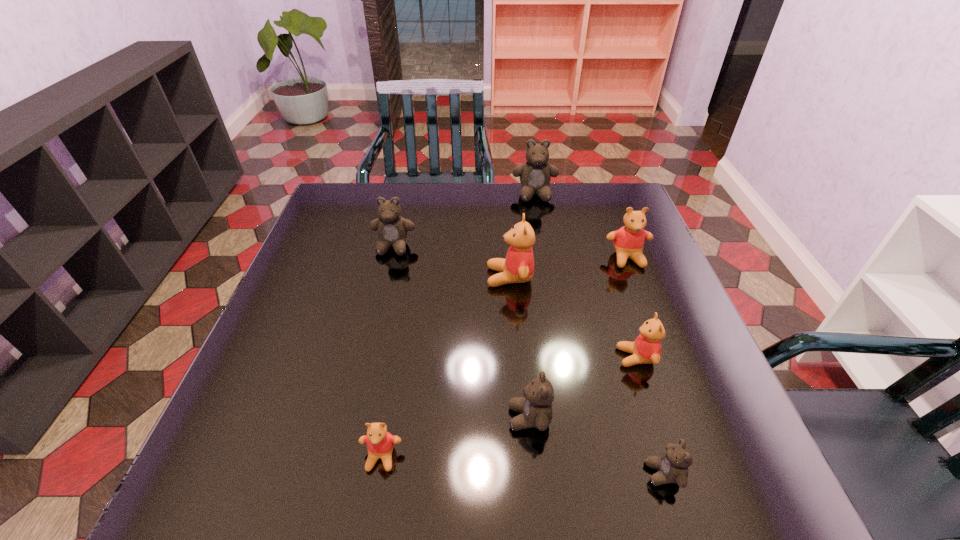
Identify which red teddy bear is the second nearest to the leftmost red teddy bear. Please provide its 2D coordinates. Your answer should be formatted as a tuple, i.e. [(x, y)], where the tuple contains the x and y coordinates of a point satisfying the conditions above.

[(646, 349)]

Locate which red teddy bear ranks second in proximity to the fourth nearest teddy bear. Please provide its 2D coordinates. Your answer should be formatted as a tuple, i.e. [(x, y)], where the tuple contains the x and y coordinates of a point satisfying the conditions above.

[(628, 241)]

At what (x,y) coordinates should I click in order to perform the action: click on free space in the image that satisfies the following two spatial constraints: 1. on the front-facing side of the second red teddy bear from left to right; 2. on the front-facing side of the leftmost red teddy bear. Please return your answer as a coordinate pair (x, y). This screenshot has height=540, width=960. Looking at the image, I should click on (523, 457).

Where is `free spot that satisfies the following two spatial constraints: 1. on the face of the biggest brown teddy bear; 2. on the front-facing side of the biggest red teddy bear`? This screenshot has height=540, width=960. free spot that satisfies the following two spatial constraints: 1. on the face of the biggest brown teddy bear; 2. on the front-facing side of the biggest red teddy bear is located at coordinates (549, 277).

The height and width of the screenshot is (540, 960). In order to click on vacant region that satisfies the following two spatial constraints: 1. on the face of the biggest brown teddy bear; 2. on the face of the third farthest brown teddy bear in this screenshot , I will do `click(573, 418)`.